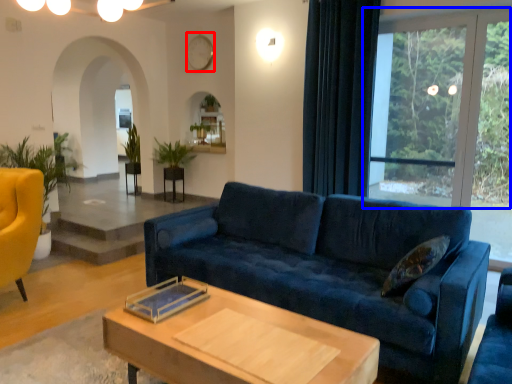
Question: Which object appears farthest to the camera in this image, clock (highlighted by a red box) or window (highlighted by a blue box)?

Choices:
 (A) clock
 (B) window

Answer: (A)